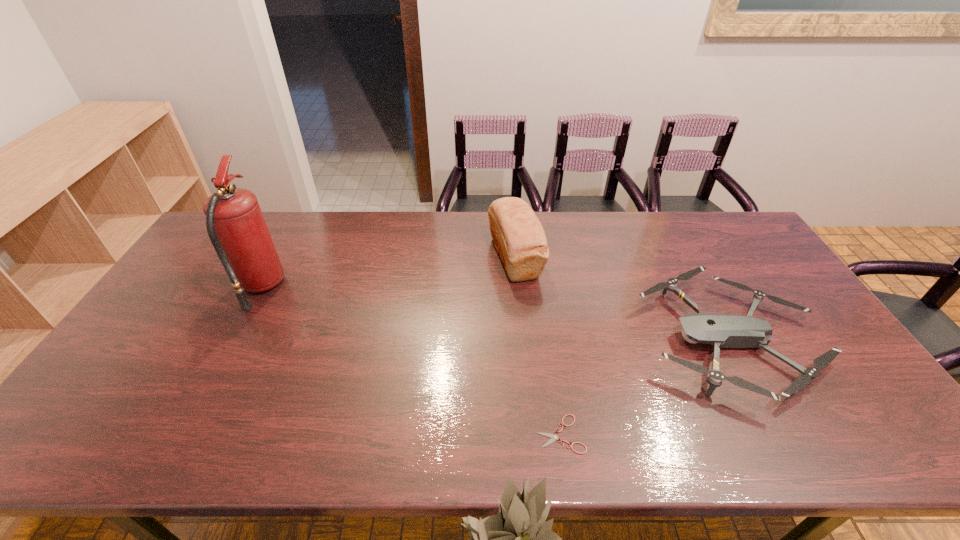
Where is `the tallest object`? the tallest object is located at coordinates (235, 224).

Locate an element on the screen. fire extinguisher is located at coordinates (235, 224).

Where is `the second tallest object`? The image size is (960, 540). the second tallest object is located at coordinates (520, 240).

The image size is (960, 540). Find the location of `the rightmost object`. the rightmost object is located at coordinates (725, 331).

Find the location of a particular element. The image size is (960, 540). the third tallest object is located at coordinates (725, 331).

This screenshot has width=960, height=540. I want to click on shears, so click(554, 437).

At what (x,y) coordinates should I click in order to perform the action: click on vacant space situated 0.330m at the front of the leftmost object where the nozzle is aimed. Please return your answer as a coordinate pair (x, y). Looking at the image, I should click on (389, 287).

Identify the location of free space located 0.290m on the right of the third shortest object. (629, 258).

Where is `free region located 0.370m with a camera mounted on the front of the drone`? This screenshot has width=960, height=540. free region located 0.370m with a camera mounted on the front of the drone is located at coordinates (508, 340).

This screenshot has height=540, width=960. I want to click on vacant space positioned with a camera mounted on the front of the drone, so click(573, 340).